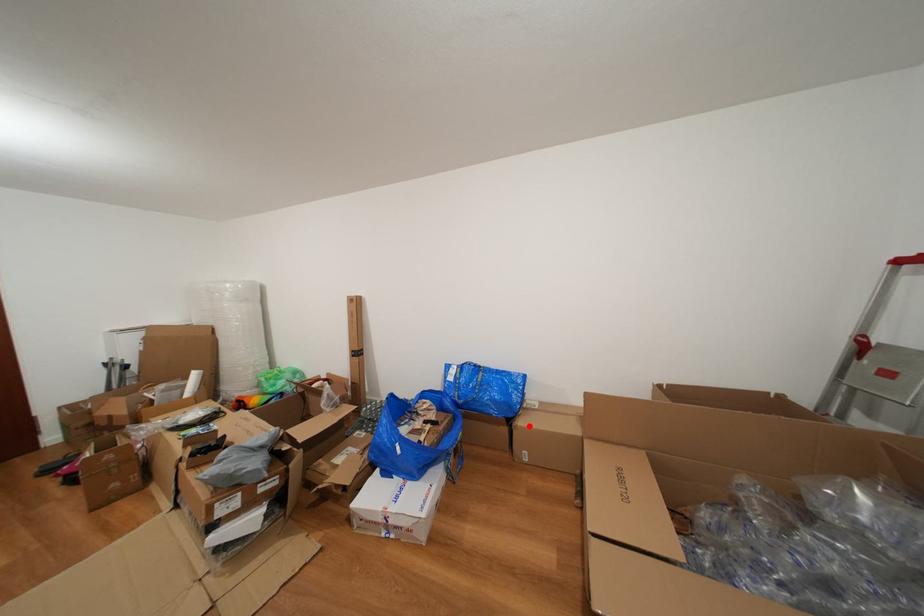
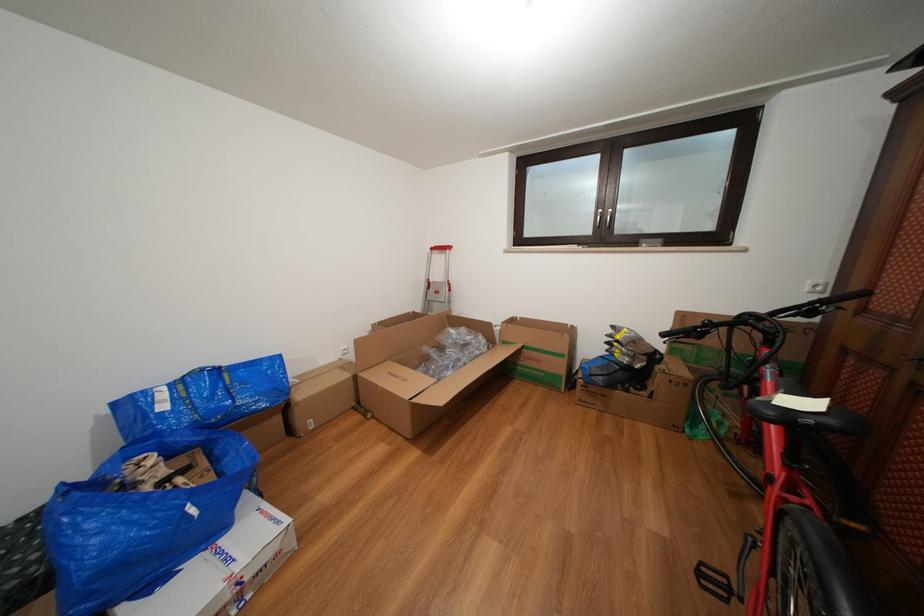
Question: I am providing you with two images of the same scene from different viewpoints. Image1 has a red point marked. In image2, the corresponding 3D location appears at what relative position? Reply with the corresponding letter.

Choices:
 (A) Closer
 (B) Farther

Answer: (A)